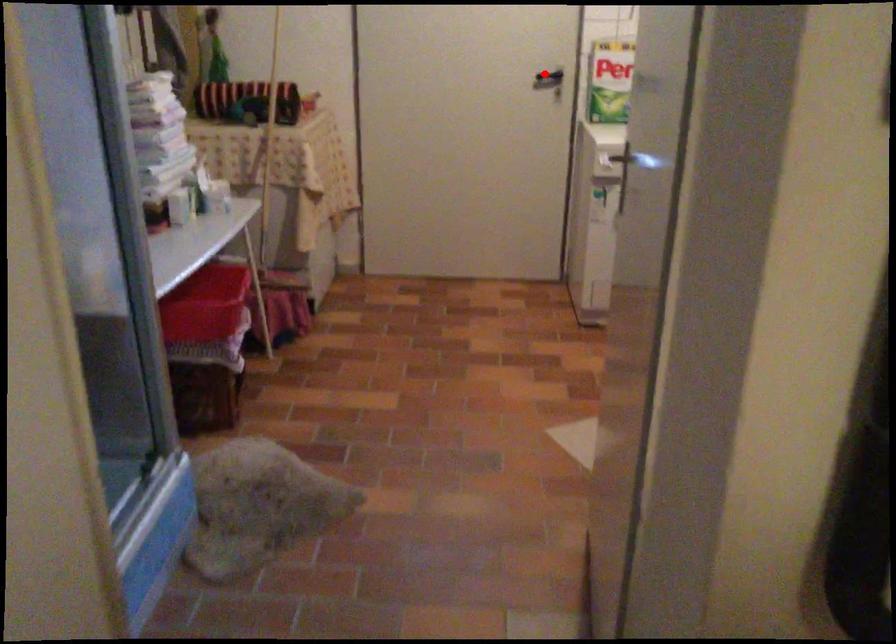
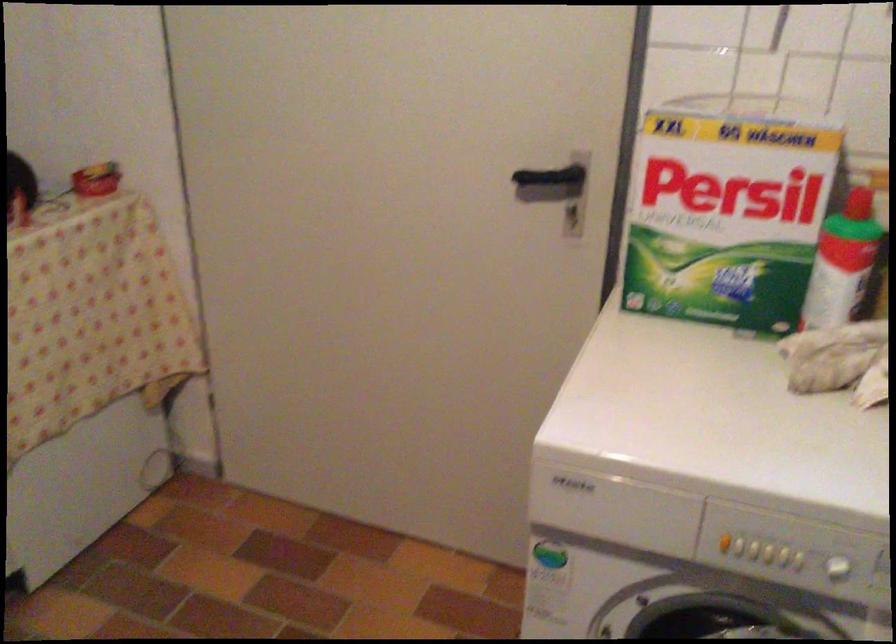
Where in the second image is the point corresponding to the highlighted location from the first image?

(553, 180)